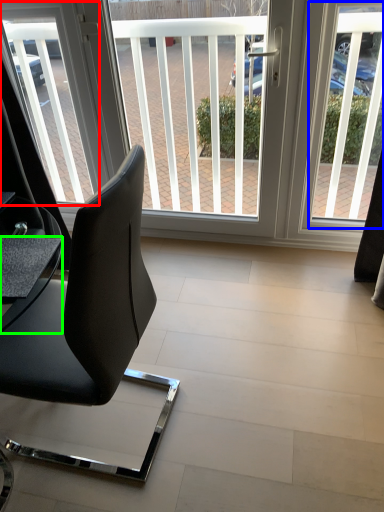
Question: Which object is the closest to the window screen (highlighted by a red box)? Choose among these: window screen (highlighted by a blue box) or table (highlighted by a green box).

Choices:
 (A) window screen
 (B) table

Answer: (B)